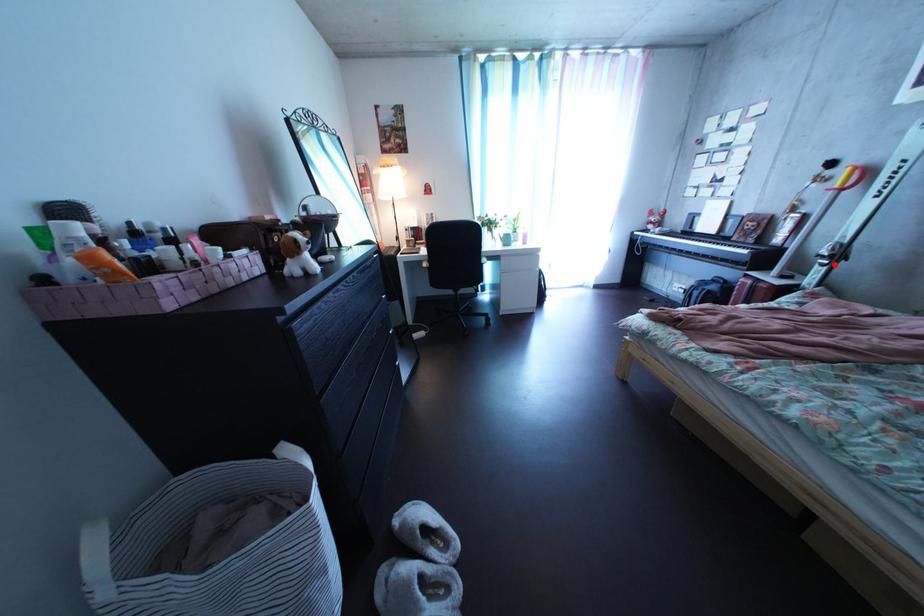
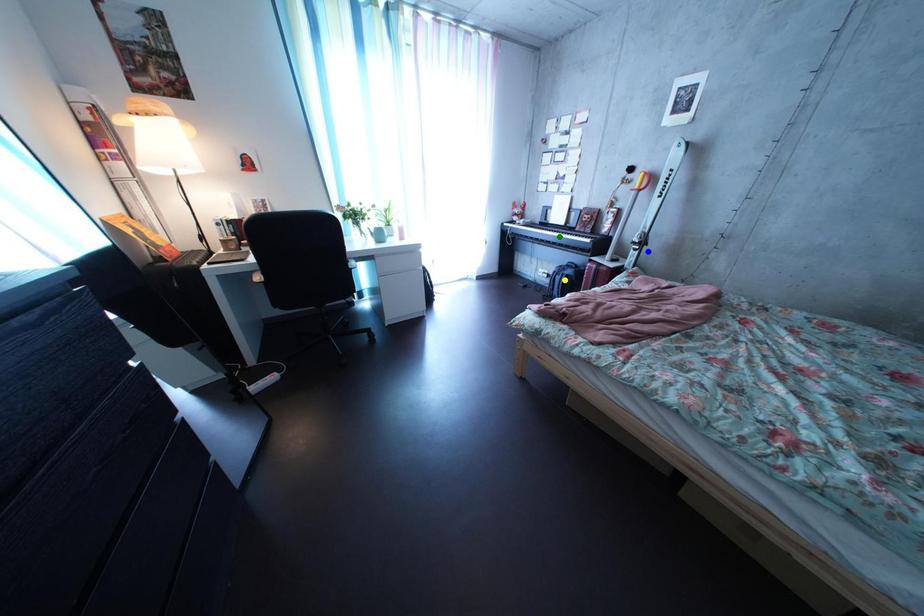
Question: I am providing you with two images of the same scene from different viewpoints. A red point is marked on the first image. You are given multiple points on the second image. Which point in image 2 represents the same 3d spot as the red point in image 1?

Choices:
 (A) yellow point
 (B) green point
 (C) blue point

Answer: (C)